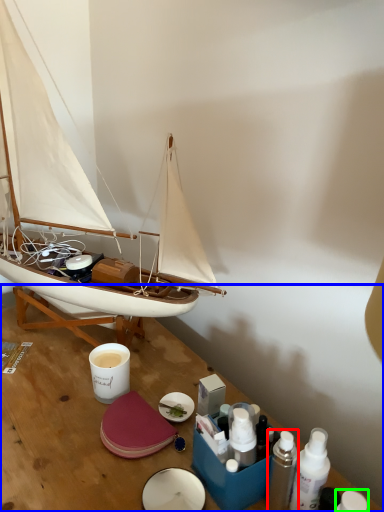
Question: Which object is the closest to the toiletry (highlighted by a red box)? Choose among these: table (highlighted by a blue box) or toiletry (highlighted by a green box).

Choices:
 (A) table
 (B) toiletry

Answer: (B)